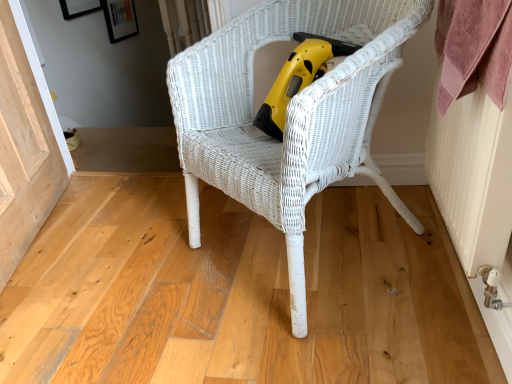
At what (x,y) coordinates should I click in order to perform the action: click on vacant space situated on the left part of white wicker chair at center. Please return your answer as a coordinate pair (x, y). Looking at the image, I should click on (135, 272).